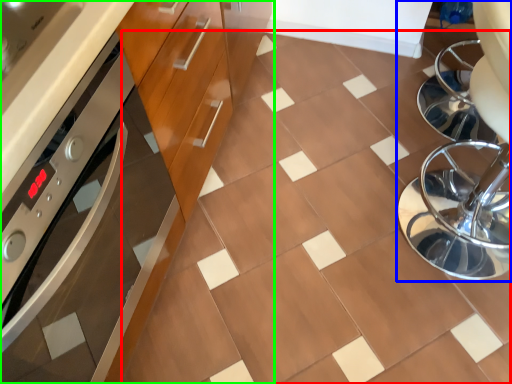
Question: Which is farther away from ceramic tile (highlighted by a red box)? swivel chair (highlighted by a blue box) or cabinetry (highlighted by a green box)?

Choices:
 (A) swivel chair
 (B) cabinetry

Answer: (B)